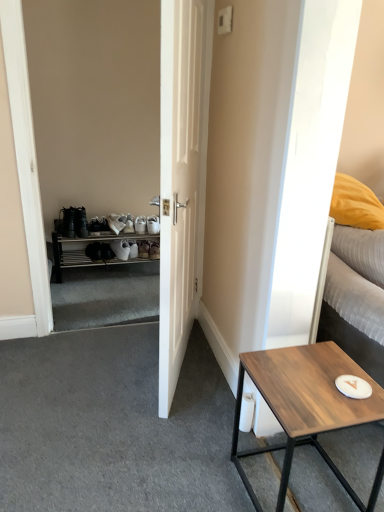
Question: Does white textured bed at right have a larger size compared to wooden table at lower right?

Choices:
 (A) yes
 (B) no

Answer: (A)

Question: Is white textured bed at right at the left side of wooden table at lower right?

Choices:
 (A) no
 (B) yes

Answer: (A)

Question: Is white textured bed at right oriented away from wooden table at lower right?

Choices:
 (A) no
 (B) yes

Answer: (B)

Question: Is white textured bed at right not inside wooden table at lower right?

Choices:
 (A) yes
 (B) no

Answer: (A)

Question: Does white textured bed at right have a smaller size compared to wooden table at lower right?

Choices:
 (A) yes
 (B) no

Answer: (B)

Question: From the image's perspective, is white plastic shoe rack at left located above or below wooden table at lower right?

Choices:
 (A) above
 (B) below

Answer: (A)

Question: Considering the positions of white plastic shoe rack at left and wooden table at lower right in the image, is white plastic shoe rack at left wider or thinner than wooden table at lower right?

Choices:
 (A) wide
 (B) thin

Answer: (B)

Question: From their relative heights in the image, would you say white plastic shoe rack at left is taller or shorter than wooden table at lower right?

Choices:
 (A) tall
 (B) short

Answer: (B)

Question: Based on their sizes in the image, would you say white plastic shoe rack at left is bigger or smaller than wooden table at lower right?

Choices:
 (A) small
 (B) big

Answer: (B)

Question: From the image's perspective, is white plastic shoe rack at left located above or below white matte door at center?

Choices:
 (A) above
 (B) below

Answer: (B)

Question: Does point (112, 243) appear closer or farther from the camera than point (187, 67)?

Choices:
 (A) farther
 (B) closer

Answer: (A)

Question: Considering their positions, is white plastic shoe rack at left located in front of or behind white matte door at center?

Choices:
 (A) behind
 (B) front

Answer: (A)

Question: In terms of width, does white plastic shoe rack at left look wider or thinner when compared to white matte door at center?

Choices:
 (A) wide
 (B) thin

Answer: (A)

Question: Visually, is white textured bed at right positioned to the left or to the right of wooden table at lower right?

Choices:
 (A) right
 (B) left

Answer: (A)

Question: From a real-world perspective, is white textured bed at right positioned above or below wooden table at lower right?

Choices:
 (A) above
 (B) below

Answer: (A)